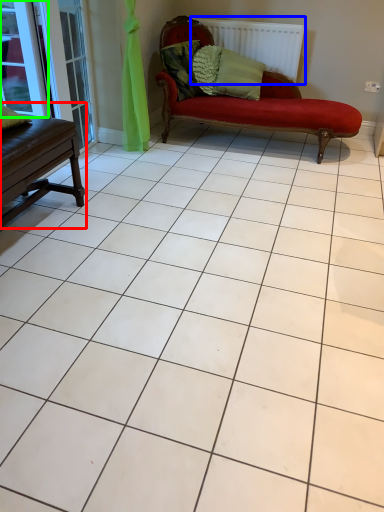
Question: Estimate the real-world distances between objects in this image. Which object is closer to table (highlighted by a red box), radiator (highlighted by a blue box) or window (highlighted by a green box)?

Choices:
 (A) radiator
 (B) window

Answer: (B)